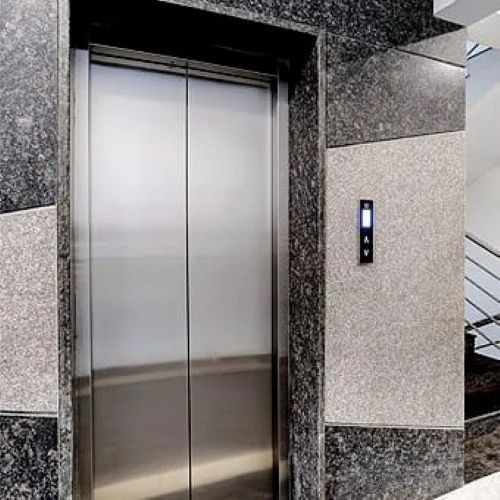
Identify the location of crease of elevator doors. Image resolution: width=500 pixels, height=500 pixels. (187, 288).